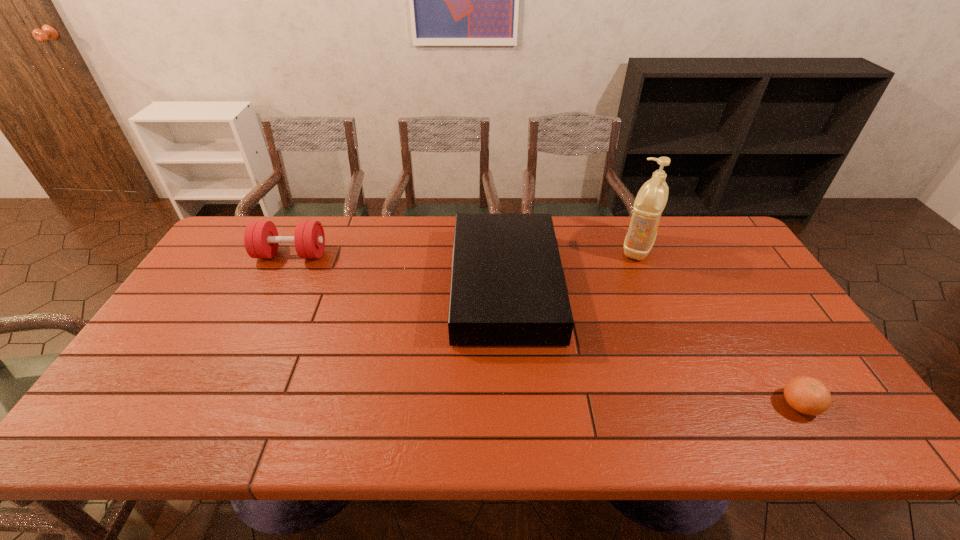
Locate an element on the screen. This screenshot has height=540, width=960. the tallest object is located at coordinates (652, 197).

The width and height of the screenshot is (960, 540). I want to click on detergent, so click(x=652, y=197).

What are the coordinates of `dumbbell` in the screenshot? It's located at (261, 240).

Locate an element on the screen. The image size is (960, 540). the leftmost object is located at coordinates (261, 240).

Identify the location of the third object from right to left. (508, 288).

Where is `the third tallest object`? This screenshot has width=960, height=540. the third tallest object is located at coordinates (508, 288).

Where is `the nearest object`? the nearest object is located at coordinates (807, 395).

Identify the location of the rightmost object. This screenshot has width=960, height=540. (807, 395).

The image size is (960, 540). Identify the location of free space located 0.270m on the front of the detergent. [672, 330].

Where is `vacant space located 0.210m on the right of the leftmost object`? The image size is (960, 540). vacant space located 0.210m on the right of the leftmost object is located at coordinates 391,254.